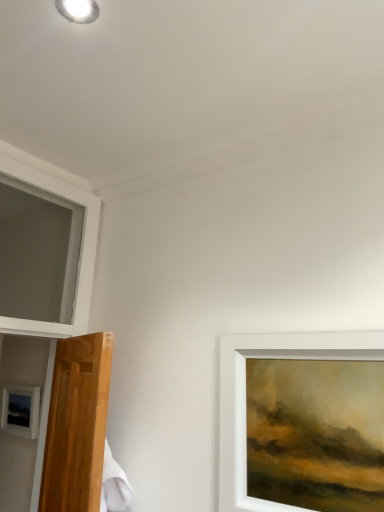
This screenshot has width=384, height=512. Describe the element at coordinates (80, 253) in the screenshot. I see `white frame at upper left` at that location.

The image size is (384, 512). I want to click on white frame at upper left, so click(x=80, y=253).

From a real-world perspective, is white frame at upper left physically located above or below white glossy droplight at upper left?

white frame at upper left is situated lower than white glossy droplight at upper left in the real world.

Does white frame at upper left have a smaller size compared to white glossy droplight at upper left?

No, white frame at upper left is not smaller than white glossy droplight at upper left.

Is white frame at upper left not within white glossy droplight at upper left?

Answer: white frame at upper left lies outside white glossy droplight at upper left's area.

From the image's perspective, would you say matte black picture frame at lower left is shown under white glossy droplight at upper left?

Yes.

Consider the image. Does matte black picture frame at lower left have a greater height compared to white glossy droplight at upper left?

Correct, matte black picture frame at lower left is much taller as white glossy droplight at upper left.

Could you measure the distance between matte black picture frame at lower left and white glossy droplight at upper left?

matte black picture frame at lower left and white glossy droplight at upper left are 5.89 feet apart.

Considering the relative sizes of matte black picture frame at lower left and white glossy droplight at upper left in the image provided, is matte black picture frame at lower left bigger than white glossy droplight at upper left?

Yes.

Would you say white glossy droplight at upper left is outside matte black picture frame at lower left?

white glossy droplight at upper left lies outside matte black picture frame at lower left's area.

Is white glossy droplight at upper left oriented away from matte black picture frame at lower left?

No, white glossy droplight at upper left's orientation is not away from matte black picture frame at lower left.

Which object is positioned more to the right, white glossy droplight at upper left or matte black picture frame at lower left?

white glossy droplight at upper left is more to the right.

Based on the photo, what's the angular difference between matte black picture frame at lower left and white frame at upper left's facing directions?

The facing directions of matte black picture frame at lower left and white frame at upper left are 90 degrees apart.

This screenshot has width=384, height=512. In order to click on window above the matte black picture frame at lower left (from the image's perspective) in this screenshot , I will do `click(80, 253)`.

Which of these two, matte black picture frame at lower left or white frame at upper left, is bigger?

white frame at upper left.

From the image's perspective, between matte black picture frame at lower left and white frame at upper left, who is located below?

From the image's view, matte black picture frame at lower left is below.

In the scene shown: From a real-world perspective, is white frame at upper left physically above matte black picture frame at lower left?

Yes, from a real-world perspective, white frame at upper left is on top of matte black picture frame at lower left.

Find the location of a particular element. window located in front of the matte black picture frame at lower left is located at coordinates (80, 253).

From the image's perspective, is white frame at upper left below matte black picture frame at lower left?

No.

Which object is more forward, white frame at upper left or matte black picture frame at lower left?

white frame at upper left is closer to the camera.

Considering the sizes of objects white glossy droplight at upper left and white frame at upper left in the image provided, who is smaller, white glossy droplight at upper left or white frame at upper left?

white glossy droplight at upper left.

Can you confirm if white glossy droplight at upper left is positioned to the right of white frame at upper left?

Yes.

From their relative heights in the image, would you say white glossy droplight at upper left is taller or shorter than white frame at upper left?

In the image, white glossy droplight at upper left appears to be shorter than white frame at upper left.

The height and width of the screenshot is (512, 384). I want to click on droplight located above the white frame at upper left (from the image's perspective), so click(78, 10).

Where is `picture frame located underneath the white glossy droplight at upper left (from a real-world perspective)`? The image size is (384, 512). picture frame located underneath the white glossy droplight at upper left (from a real-world perspective) is located at coordinates (20, 411).

Looking at the image, which one is located closer to matte black picture frame at lower left, white glossy droplight at upper left or white frame at upper left?

white frame at upper left is positioned closer to the anchor matte black picture frame at lower left.

Consider the image. When comparing their distances from matte black picture frame at lower left, does white frame at upper left or white glossy droplight at upper left seem further?

white glossy droplight at upper left.

Considering their positions, is matte black picture frame at lower left positioned closer to white frame at upper left than white glossy droplight at upper left?

matte black picture frame at lower left is closer to white frame at upper left.

Considering their positions, is matte black picture frame at lower left positioned further to white glossy droplight at upper left than white frame at upper left?

matte black picture frame at lower left is further to white glossy droplight at upper left.

Estimate the real-world distances between objects in this image. Which object is further from white frame at upper left, white glossy droplight at upper left or matte black picture frame at lower left?

Based on the image, white glossy droplight at upper left appears to be further to white frame at upper left.

Based on their spatial positions, is white frame at upper left or matte black picture frame at lower left closer to white glossy droplight at upper left?

The object closer to white glossy droplight at upper left is white frame at upper left.

Identify the location of window between white glossy droplight at upper left and matte black picture frame at lower left in the vertical direction. (80, 253).